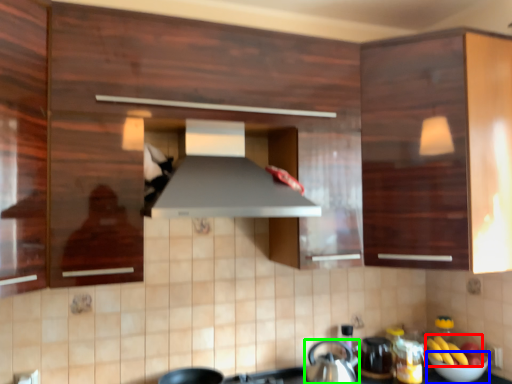
Question: Which is farther away from banana (highlighted by a red box)? bowl (highlighted by a blue box) or kitchen appliance (highlighted by a green box)?

Choices:
 (A) bowl
 (B) kitchen appliance

Answer: (B)